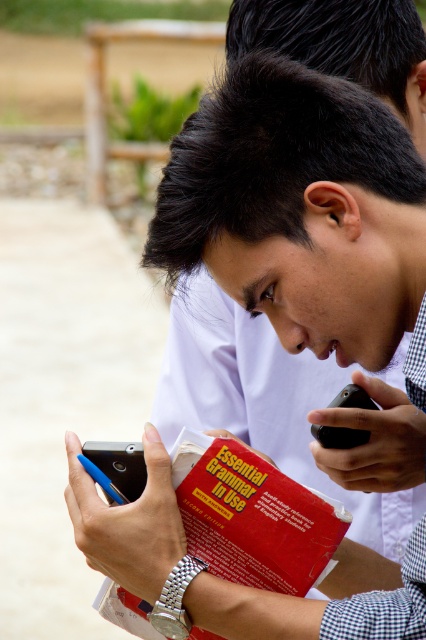
Question: Which point is farther from the camera taking this photo?

Choices:
 (A) (227, 470)
 (B) (112, 465)

Answer: (B)

Question: Which is farther from the red matte book at center?

Choices:
 (A) black matte smartphone at center
 (B) red paper book at center
 (C) blue glossy smartphone at lower left

Answer: (A)

Question: Among these points, which one is nearest to the camera?

Choices:
 (A) (115, 472)
 (B) (363, 440)

Answer: (A)

Question: Is red matte book at center bigger than blue glossy smartphone at lower left?

Choices:
 (A) yes
 (B) no

Answer: (A)

Question: Can you confirm if black matte smartphone at center is bigger than red paper book at center?

Choices:
 (A) no
 (B) yes

Answer: (B)

Question: Can you confirm if black matte smartphone at center is positioned to the right of red paper book at center?

Choices:
 (A) yes
 (B) no

Answer: (A)